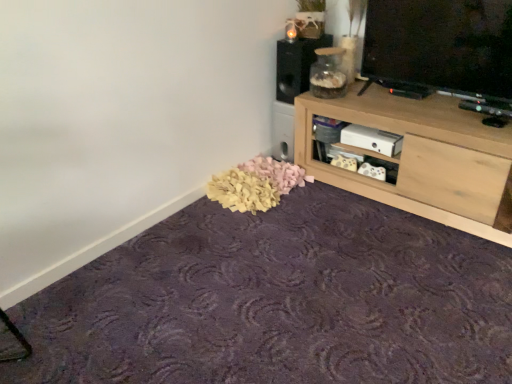
Identify the location of free spot above black matte speaker at upper center (from a real-world perspective). (302, 35).